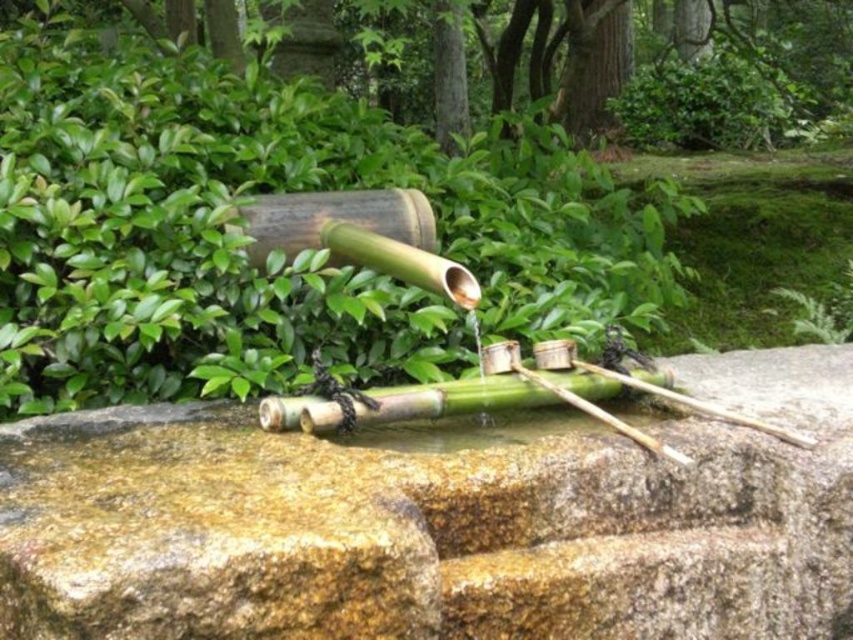
You are a visitor in a Japanese garden and want to place a small statue between the green leafy bush at upper left and the green stone basin at center. Where should you place it to ensure it is closer to the basin?

The statue should be placed closer to the green stone basin at center since it is to the right of the green leafy bush at upper left.

You are designing a miniature garden and want to place both the green stone basin at center and the green leafy bush at upper left in your model. Given their sizes, which object should you prioritize placing first to ensure they both fit properly?

The green leafy bush at upper left should be placed first because it occupies more space than the green stone basin at center, ensuring there is enough room for both in the miniature garden.

Based on the photo, you are designing a garden layout and need to place a new decorative rock. The green stone basin at center and the green leafy bush at upper left are already present. Which object has a smaller width, requiring less space for placement around it?

The green stone basin at center has a smaller width than the green leafy bush at upper left, so it requires less space for placement around it.